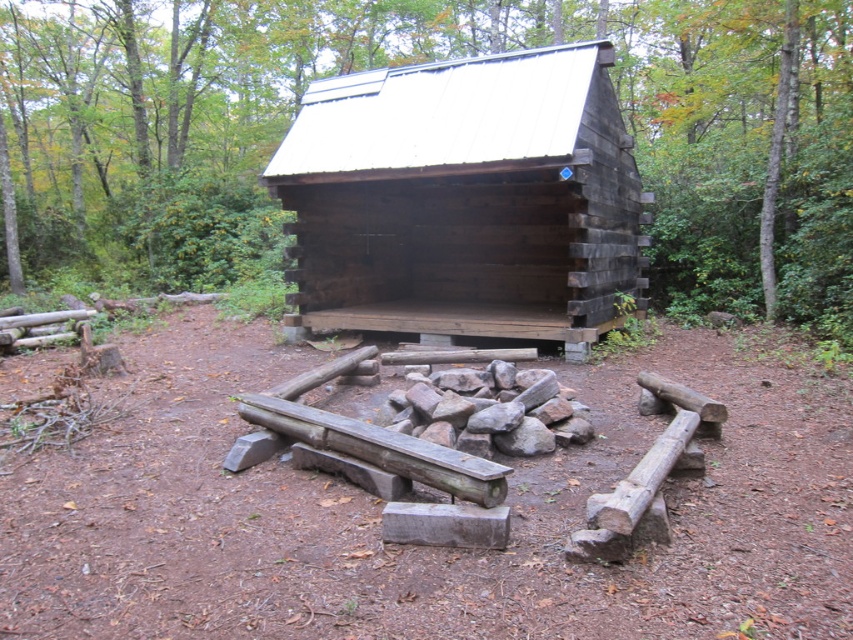
Measure the distance between dark brown wood log cabin at center and green leafy tree at upper right.

A distance of 12.60 feet exists between dark brown wood log cabin at center and green leafy tree at upper right.

Is dark brown wood log cabin at center thinner than green leafy tree at upper right?

Incorrect, dark brown wood log cabin at center's width is not less than green leafy tree at upper right's.

Identify the location of dark brown wood log cabin at center. The height and width of the screenshot is (640, 853). (463, 198).

This screenshot has width=853, height=640. I want to click on dark brown wood log cabin at center, so click(463, 198).

Who is shorter, brown wooden shelter at center or green leafy tree at upper right?

Standing shorter between the two is green leafy tree at upper right.

Is brown wooden shelter at center shorter than green leafy tree at upper right?

Incorrect, brown wooden shelter at center's height does not fall short of green leafy tree at upper right's.

Does point (209, 262) come in front of point (677, 45)?

Yes, it is in front of point (677, 45).

Identify the location of brown wooden shelter at center. (451, 152).

Is brown wooden shelter at center to the right of dark brown wood log cabin at center from the viewer's perspective?

Incorrect, brown wooden shelter at center is not on the right side of dark brown wood log cabin at center.

Who is more forward, [578,221] or [433,93]?

Positioned in front is point [578,221].

Measure the distance between point (496,177) and camera.

The distance of point (496,177) from camera is 27.29 feet.

The image size is (853, 640). What are the coordinates of `brown wooden shelter at center` in the screenshot? It's located at (451, 152).